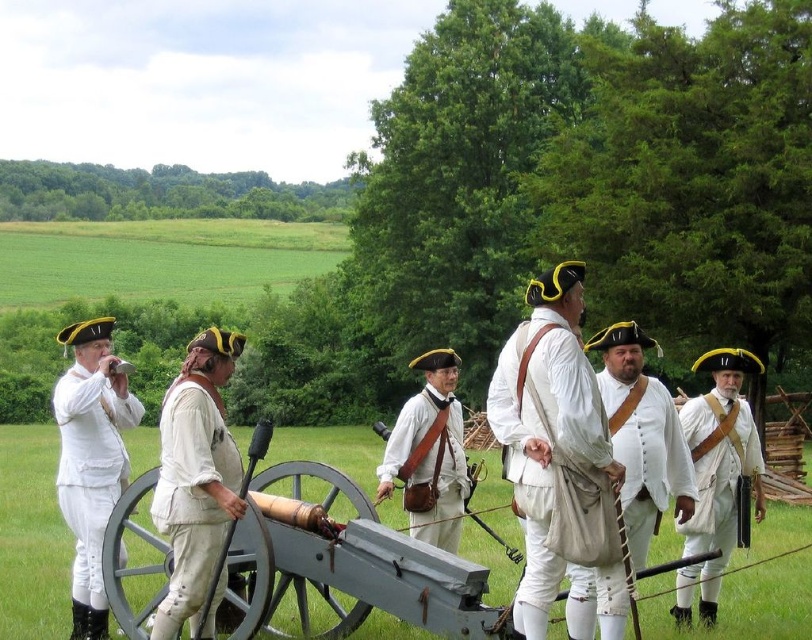
Does white leather hat at center have a smaller size compared to white leather uniform at center?

Indeed, white leather hat at center has a smaller size compared to white leather uniform at center.

Is point (681, 589) in front of point (461, 509)?

Yes.

You are a GUI agent. You are given a task and a screenshot of the screen. Output one action in this format:
    pyautogui.click(x=<x>, y=<y>)
    Task: Click on the white leather hat at center
    This screenshot has width=812, height=640.
    Given the screenshot: What is the action you would take?
    pyautogui.click(x=717, y=476)

Can you confirm if white cotton coat at center is wider than white cotton shirt at center?

Yes, white cotton coat at center is wider than white cotton shirt at center.

Who is more forward, (616,476) or (176,520)?

Point (616,476) is in front.

What do you see at coordinates (547, 426) in the screenshot? This screenshot has width=812, height=640. I see `white cotton coat at center` at bounding box center [547, 426].

I want to click on white cotton coat at center, so click(x=547, y=426).

Does white cotton shirt at center come in front of white leather uniform at center?

That is True.

From the picture: Does white cotton shirt at center appear on the right side of white leather uniform at center?

Incorrect, white cotton shirt at center is not on the right side of white leather uniform at center.

Is point (171, 497) positioned in front of point (413, 509)?

That is True.

Where is `white cotton shirt at center`? Image resolution: width=812 pixels, height=640 pixels. white cotton shirt at center is located at coordinates (193, 496).